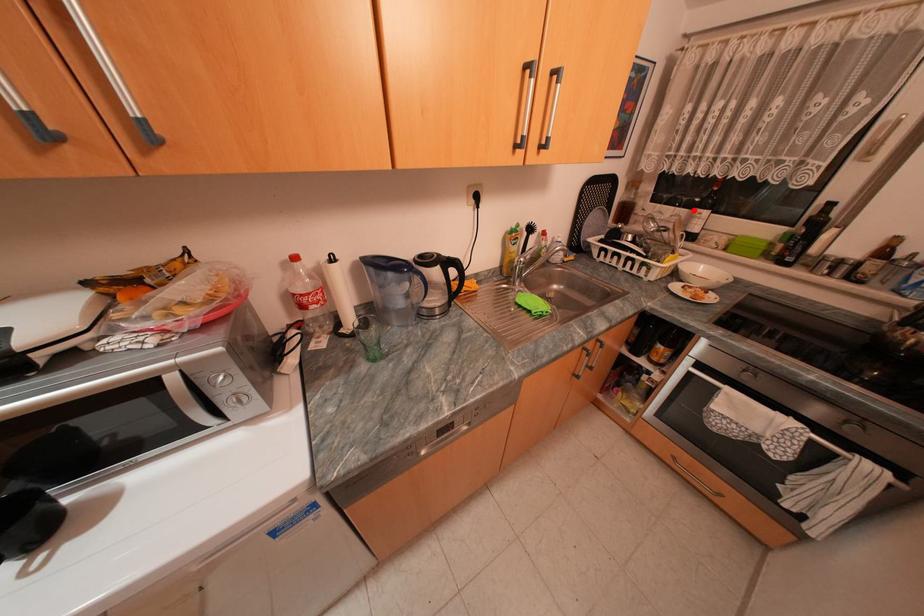
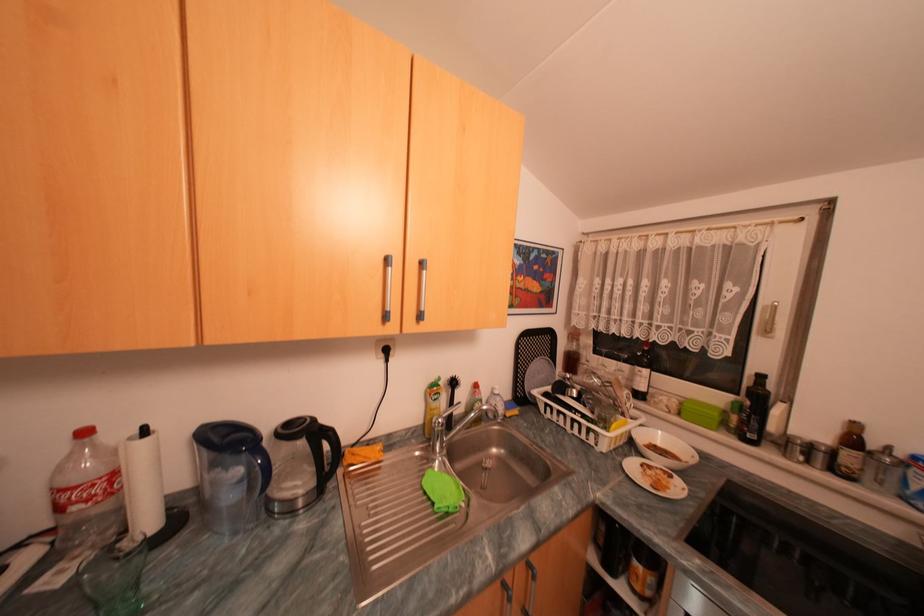
Where in the second image is the point corresponding to the highlighted location from the first image?

(636, 366)